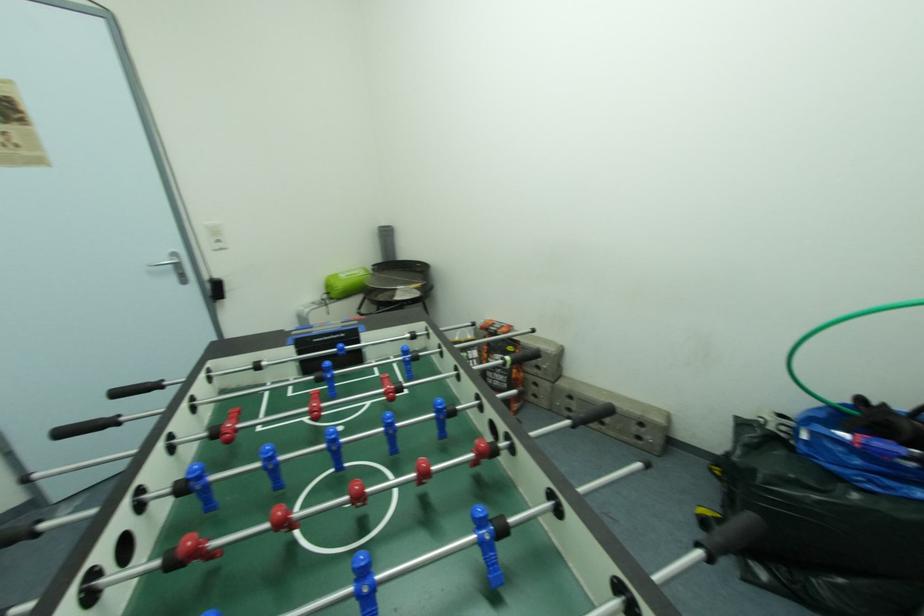
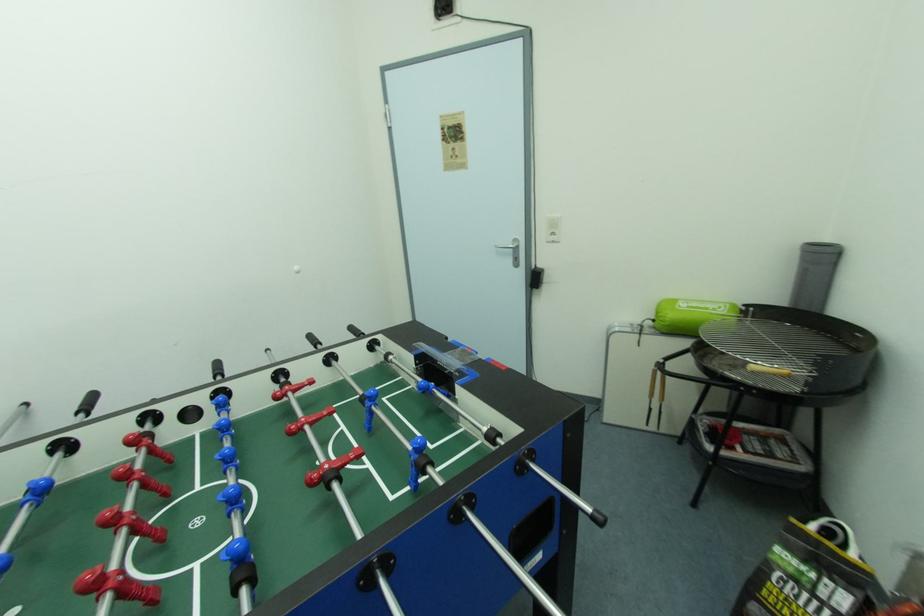
Question: The camera is either moving clockwise (left) or counter-clockwise (right) around the object. The first image is from the beginning of the video and the second image is from the end. Is the camera moving left or right when shooting the video?

Choices:
 (A) Left
 (B) Right

Answer: (B)